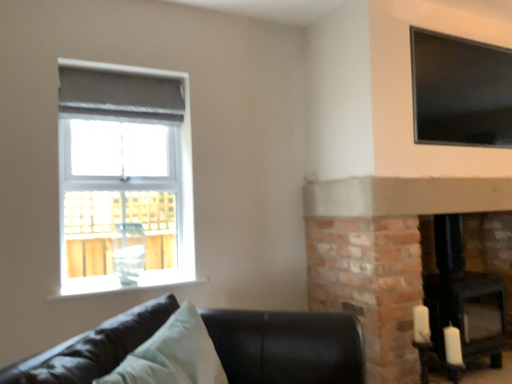
Question: From a real-world perspective, is matte gray roller blind at upper left, the first window positioned from the left, on top of black matte fireplace at lower right?

Choices:
 (A) yes
 (B) no

Answer: (A)

Question: Is matte gray roller blind at upper left, the first window positioned from the left, wider than black matte fireplace at lower right?

Choices:
 (A) no
 (B) yes

Answer: (A)

Question: Does matte gray roller blind at upper left, which is the 2th window in right-to-left order, have a greater height compared to black matte fireplace at lower right?

Choices:
 (A) no
 (B) yes

Answer: (B)

Question: Considering the relative positions of matte gray roller blind at upper left, the first window positioned from the left, and black matte fireplace at lower right in the image provided, is matte gray roller blind at upper left, the first window positioned from the left, to the left of black matte fireplace at lower right from the viewer's perspective?

Choices:
 (A) yes
 (B) no

Answer: (A)

Question: From a real-world perspective, is matte gray roller blind at upper left, which is the 2th window in right-to-left order, located beneath black matte fireplace at lower right?

Choices:
 (A) no
 (B) yes

Answer: (A)

Question: From a real-world perspective, is matte gray roller blind at upper left, the first window positioned from the left, positioned above or below light blue fabric pillow at lower left?

Choices:
 (A) above
 (B) below

Answer: (A)

Question: Is matte gray roller blind at upper left, the first window positioned from the left, to the left or to the right of light blue fabric pillow at lower left in the image?

Choices:
 (A) right
 (B) left

Answer: (B)

Question: Relative to light blue fabric pillow at lower left, is matte gray roller blind at upper left, which is the 2th window in right-to-left order, in front or behind?

Choices:
 (A) front
 (B) behind

Answer: (B)

Question: Considering the positions of matte gray roller blind at upper left, the first window positioned from the left, and light blue fabric pillow at lower left in the image, is matte gray roller blind at upper left, the first window positioned from the left, bigger or smaller than light blue fabric pillow at lower left?

Choices:
 (A) big
 (B) small

Answer: (A)

Question: Is transparent glass window at upper right, marked as the second window in a left-to-right arrangement, bigger or smaller than black leather couch at lower left?

Choices:
 (A) small
 (B) big

Answer: (A)

Question: Relative to black leather couch at lower left, is transparent glass window at upper right, the first window in the right-to-left sequence, in front or behind?

Choices:
 (A) front
 (B) behind

Answer: (B)

Question: From a real-world perspective, is transparent glass window at upper right, marked as the second window in a left-to-right arrangement, above or below black leather couch at lower left?

Choices:
 (A) above
 (B) below

Answer: (A)

Question: Is transparent glass window at upper right, the first window in the right-to-left sequence, to the left or to the right of black leather couch at lower left in the image?

Choices:
 (A) right
 (B) left

Answer: (A)

Question: Visually, is black matte fireplace at lower right positioned to the left or to the right of transparent glass window at upper right, the first window in the right-to-left sequence?

Choices:
 (A) right
 (B) left

Answer: (B)

Question: Looking at their shapes, would you say black matte fireplace at lower right is wider or thinner than transparent glass window at upper right, the first window in the right-to-left sequence?

Choices:
 (A) thin
 (B) wide

Answer: (B)